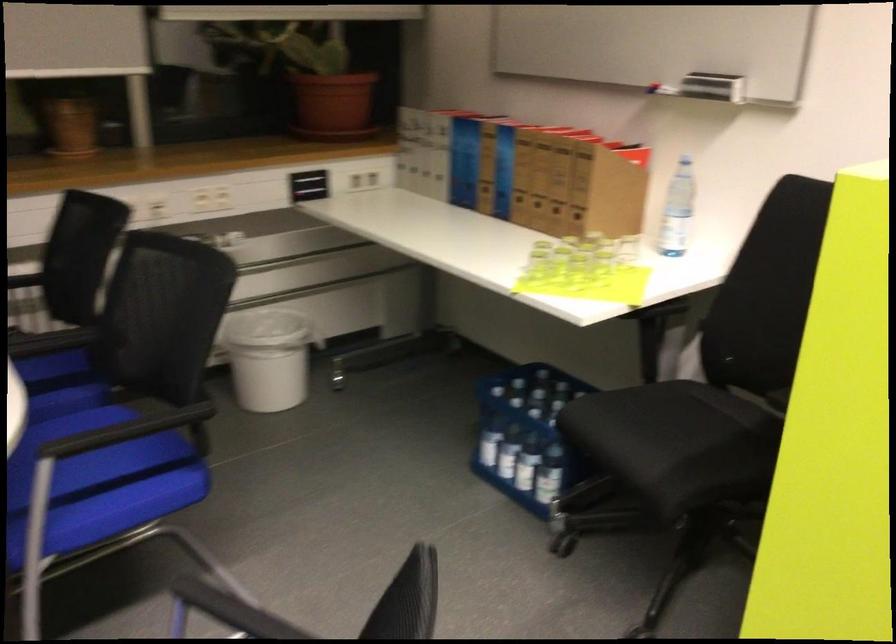
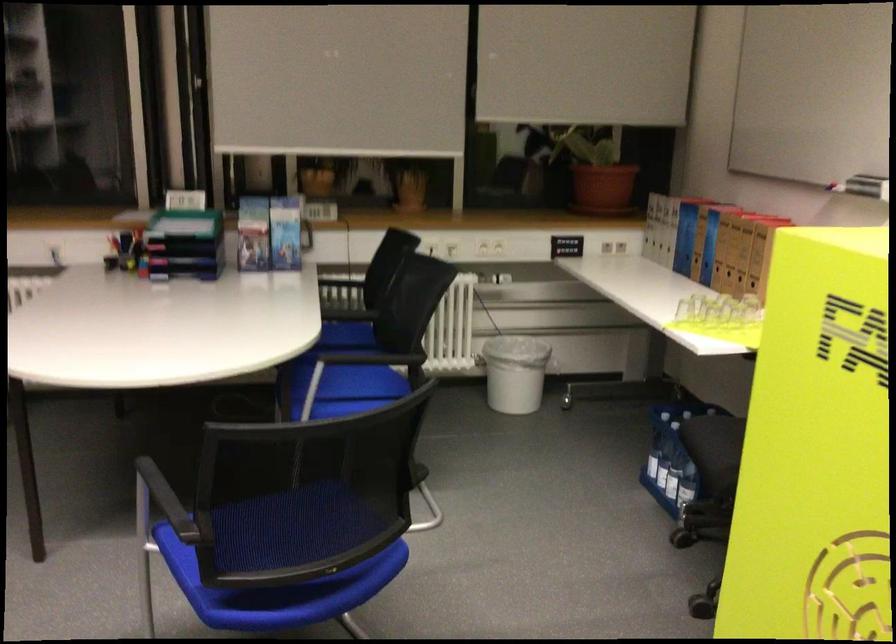
Locate, in the second image, the point that corresponds to the point at 561,172 in the first image.

(746, 243)